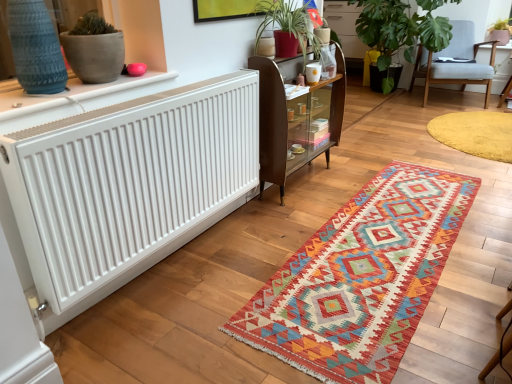
The height and width of the screenshot is (384, 512). I want to click on free location to the left of knitted woolen rug at center, which is the 1th mat from bottom to top, so click(239, 254).